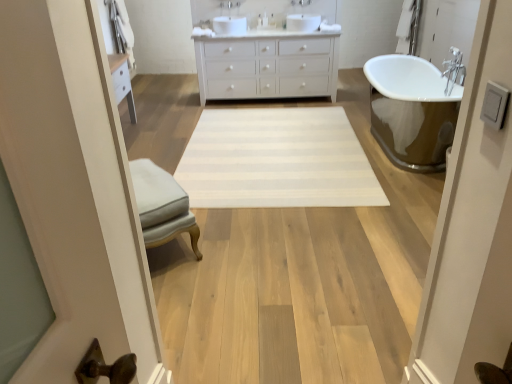
At what (x,y) coordinates should I click in order to perform the action: click on free point above white striped rug at center (from a real-world perspective). Please return your answer as a coordinate pair (x, y). The image size is (512, 384). Looking at the image, I should click on (259, 149).